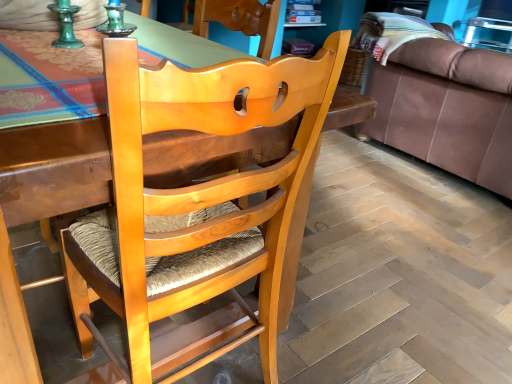
Image resolution: width=512 pixels, height=384 pixels. What do you see at coordinates (198, 206) in the screenshot? I see `light brown wood chair at center` at bounding box center [198, 206].

In order to click on light brown wood chair at center in this screenshot , I will do `click(198, 206)`.

What do you see at coordinates (446, 108) in the screenshot?
I see `brown leather couch at right` at bounding box center [446, 108].

Locate an element on the screen. The image size is (512, 384). brown leather couch at right is located at coordinates (446, 108).

Locate an element on the screen. light brown wood chair at center is located at coordinates (198, 206).

Considering the relative positions of brown leather couch at right and light brown wood chair at center in the image provided, is brown leather couch at right to the right of light brown wood chair at center from the viewer's perspective?

Yes.

Relative to light brown wood chair at center, is brown leather couch at right in front or behind?

brown leather couch at right is behind light brown wood chair at center.

Is point (400, 71) behind point (143, 121)?

That is True.

From the image's perspective, which is below, brown leather couch at right or light brown wood chair at center?

light brown wood chair at center is shown below in the image.

Looking at this image, from a real-world perspective, who is located lower, brown leather couch at right or light brown wood chair at center?

From a 3D spatial view, brown leather couch at right is below.

Considering the relative sizes of brown leather couch at right and light brown wood chair at center in the image provided, is brown leather couch at right wider than light brown wood chair at center?

Indeed, brown leather couch at right has a greater width compared to light brown wood chair at center.

Consider the image. Is brown leather couch at right shorter than light brown wood chair at center?

Yes, brown leather couch at right is shorter than light brown wood chair at center.

Considering the relative sizes of brown leather couch at right and light brown wood chair at center in the image provided, is brown leather couch at right bigger than light brown wood chair at center?

Yes.

Does brown leather couch at right contain light brown wood chair at center?

No, light brown wood chair at center is not surrounded by brown leather couch at right.

Would you consider brown leather couch at right to be distant from light brown wood chair at center?

Yes, brown leather couch at right and light brown wood chair at center are located far from each other.

Is brown leather couch at right turned away from light brown wood chair at center?

That's right, brown leather couch at right is facing away from light brown wood chair at center.

Locate an element on the screen. The height and width of the screenshot is (384, 512). chair that appears below the brown leather couch at right (from the image's perspective) is located at coordinates (198, 206).

Can you confirm if light brown wood chair at center is positioned to the left of brown leather couch at right?

Correct, you'll find light brown wood chair at center to the left of brown leather couch at right.

From the picture: Considering the relative positions of light brown wood chair at center and brown leather couch at right in the image provided, is light brown wood chair at center in front of brown leather couch at right?

Yes, light brown wood chair at center is closer to the viewer.

Which point is more forward, (102, 271) or (500, 97)?

The point (102, 271) is more forward.

From the image's perspective, which is above, light brown wood chair at center or brown leather couch at right?

brown leather couch at right is shown above in the image.

From a real-world perspective, which object stands above the other?

In real-world perspective, light brown wood chair at center is above.

Which of these two, light brown wood chair at center or brown leather couch at right, is wider?

With larger width is brown leather couch at right.

In terms of height, does light brown wood chair at center look taller or shorter compared to brown leather couch at right?

light brown wood chair at center is taller than brown leather couch at right.

Can you confirm if light brown wood chair at center is bigger than brown leather couch at right?

No, light brown wood chair at center is not bigger than brown leather couch at right.

Is light brown wood chair at center located outside brown leather couch at right?

Indeed, light brown wood chair at center is completely outside brown leather couch at right.

Are light brown wood chair at center and brown leather couch at right beside each other?

No, light brown wood chair at center is not with brown leather couch at right.

Does light brown wood chair at center turn towards brown leather couch at right?

No, light brown wood chair at center does not turn towards brown leather couch at right.

Can you tell me how much light brown wood chair at center and brown leather couch at right differ in facing direction?

The angle between the facing direction of light brown wood chair at center and the facing direction of brown leather couch at right is 90.9 degrees.

This screenshot has width=512, height=384. In order to click on chair lying in front of the brown leather couch at right in this screenshot , I will do `click(198, 206)`.

I want to click on chair below the brown leather couch at right (from the image's perspective), so click(x=198, y=206).

This screenshot has width=512, height=384. Find the location of `studio couch behind the light brown wood chair at center`. studio couch behind the light brown wood chair at center is located at coordinates (446, 108).